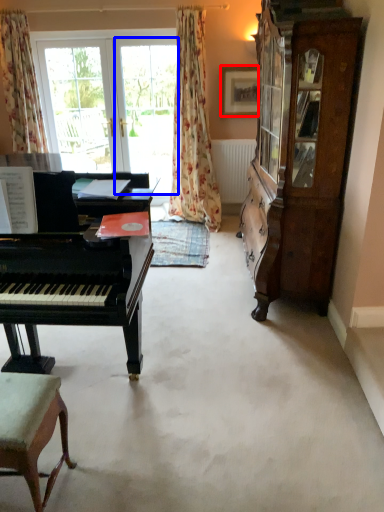
Question: Which object appears farthest to the camera in this image, picture frame (highlighted by a red box) or screen door (highlighted by a blue box)?

Choices:
 (A) picture frame
 (B) screen door

Answer: (B)